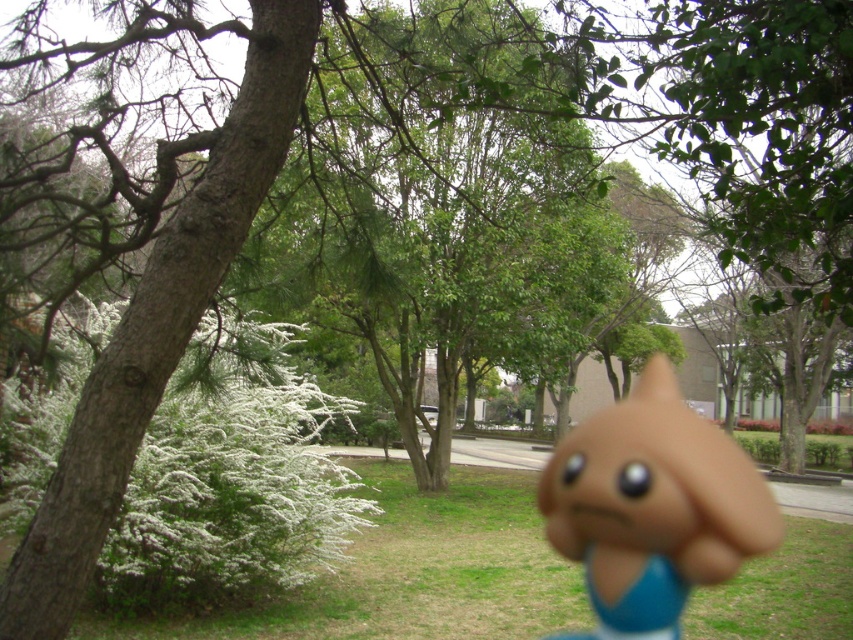
You are a child playing in the outdoor area. You see the green grass at lower left and the brown rubber toy at center. Which object is closer to your left side?

The green grass at lower left is closer to your left side because it is positioned to the left of the brown rubber toy at center.

You are standing in the outdoor scene described. There is a point marked at coordinates (410, 572). What object is located at that point?

The point at coordinates (410, 572) marks green grass at lower left.